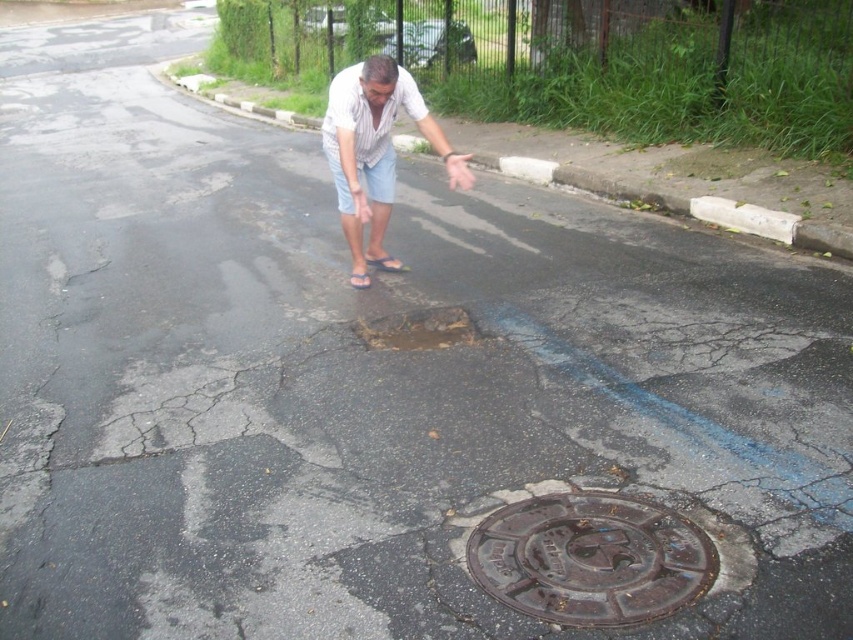
In the scene shown: Between brown textured manhole cover at center and rusty metal manhole cover at center, which one is positioned higher?

rusty metal manhole cover at center is higher up.

The width and height of the screenshot is (853, 640). I want to click on brown textured manhole cover at center, so click(590, 557).

The image size is (853, 640). What do you see at coordinates (590, 557) in the screenshot?
I see `brown textured manhole cover at center` at bounding box center [590, 557].

At what (x,y) coordinates should I click in order to perform the action: click on brown textured manhole cover at center. Please return your answer as a coordinate pair (x, y). Image resolution: width=853 pixels, height=640 pixels. Looking at the image, I should click on (590, 557).

Is white striped shirt at center to the right of rusty metal manhole cover at center from the viewer's perspective?

In fact, white striped shirt at center is to the left of rusty metal manhole cover at center.

Is the position of white striped shirt at center more distant than that of rusty metal manhole cover at center?

Yes, it is behind rusty metal manhole cover at center.

Does point (328, 141) lie behind point (439, 332)?

Yes, it is behind point (439, 332).

At what (x,y) coordinates should I click in order to perform the action: click on white striped shirt at center. Please return your answer as a coordinate pair (x, y). This screenshot has width=853, height=640. Looking at the image, I should click on (375, 152).

The width and height of the screenshot is (853, 640). What are the coordinates of `brown textured manhole cover at center` in the screenshot? It's located at (590, 557).

Is the position of brown textured manhole cover at center more distant than that of white striped shirt at center?

No, it is in front of white striped shirt at center.

Is point (665, 586) positioned in front of point (351, 170)?

Yes, point (665, 586) is closer to viewer.

The height and width of the screenshot is (640, 853). Find the location of `brown textured manhole cover at center`. brown textured manhole cover at center is located at coordinates pyautogui.click(x=590, y=557).